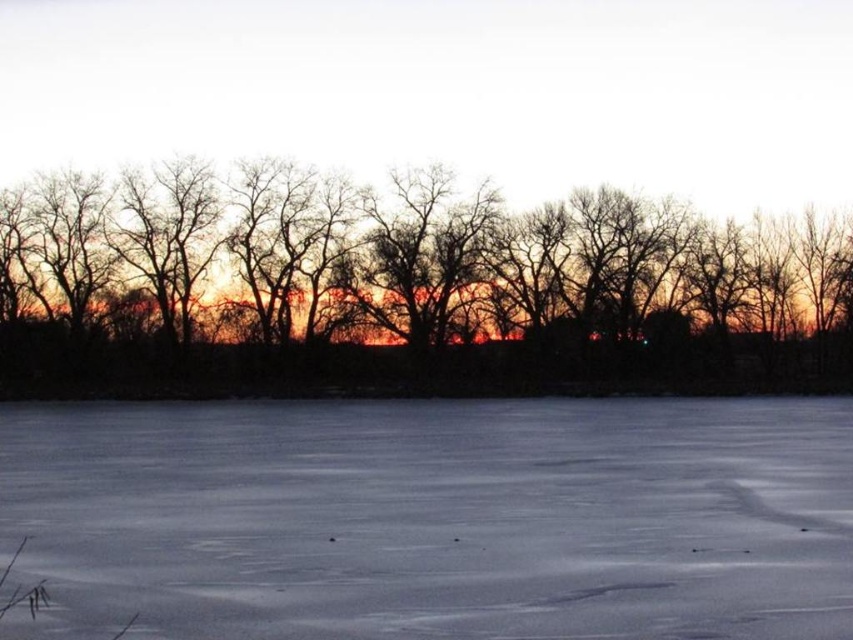
You are an artist trying to paint the winter landscape. You need to decide which area to focus on first based on their widths. Which object has a narrower width between the white smooth snow at center and the black matte trees at center?

The white smooth snow at center has a lesser width compared to the black matte trees at center, so it is narrower and should be focused on first.

You are standing in the winter landscape and want to place a small snowman exactly halfway between point (489, 515) and point (515, 380). Given that the snowman must be placed on the snow in the foreground, will the snowman be closer to the camera than both points?

Point (489, 515) is closer to the camera than point (515, 380). The halfway point between them would be closer to the camera than point (515, 380) but farther than point (489, 515). Therefore, the snowman will not be closer to the camera than both points.

You are an observer standing in the winter landscape. You see the white smooth snow at center and the black matte trees at center. Which object is closer to the ground?

The white smooth snow at center is closer to the ground because it is positioned below the black matte trees at center.